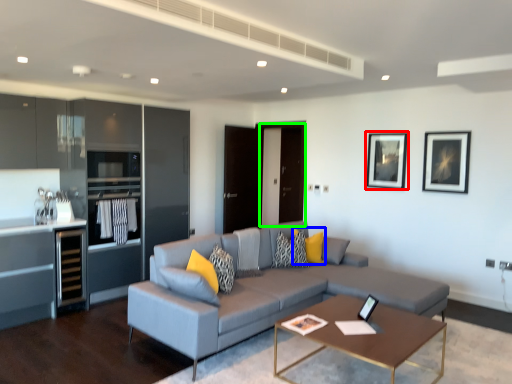
Question: Which object is positioned farthest from picture frame (highlighted by a red box)? Select from pillow (highlighted by a blue box) and glass door (highlighted by a green box).

Choices:
 (A) pillow
 (B) glass door

Answer: (A)